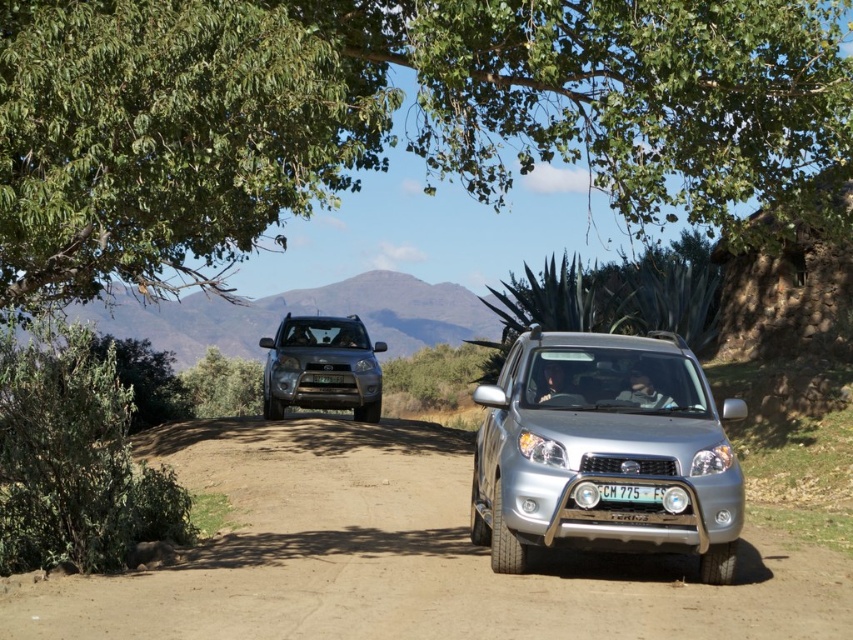
You are a hiker planning to walk along the dirt track at center. You want to stay in the shade provided by the green leafy tree at upper left. Which direction should you walk to stay under the tree?

The dirt track at center is below the green leafy tree at upper left, so walking along the dirt track at center towards the tree would keep you in the shade provided by the green leafy tree at upper left.

You are a hiker planning to walk along the dirt track at center. You notice a green leafy tree at upper left in the distance. Which direction should you walk to get closer to the tree while staying on the track?

The dirt track at center is positioned on the right side of the green leafy tree at upper left, so to get closer to the tree while staying on the track, you should walk to the left along the dirt track at center.